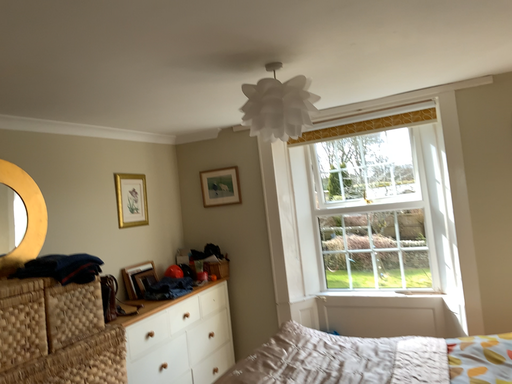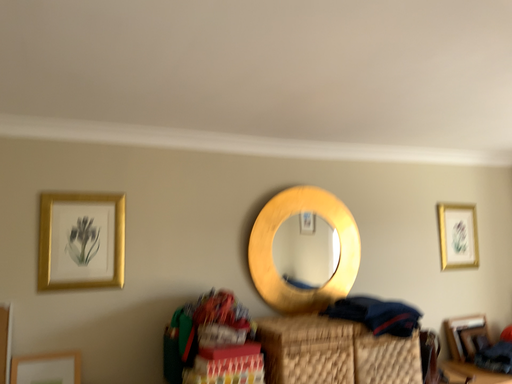
Question: Which way did the camera rotate in the video?

Choices:
 (A) rotated right
 (B) rotated left

Answer: (B)